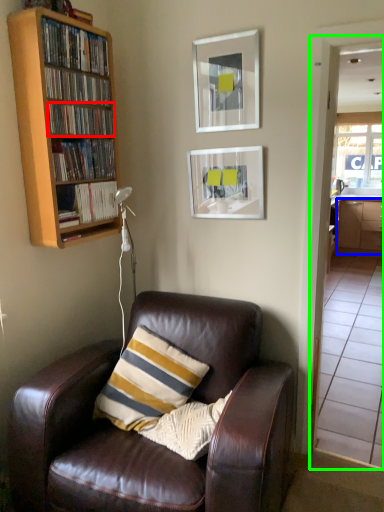
Question: Which object is positioned farthest from book (highlighted by a red box)? Select from cabinetry (highlighted by a blue box) and glass door (highlighted by a green box).

Choices:
 (A) cabinetry
 (B) glass door

Answer: (A)